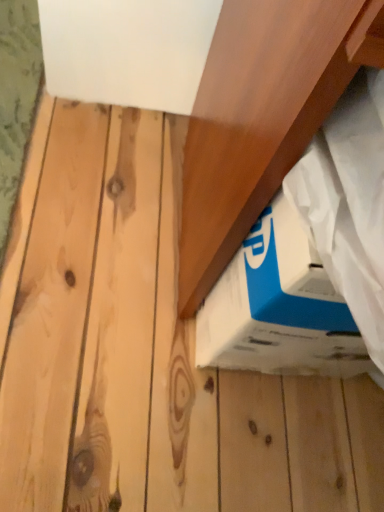
Question: In terms of width, does blue cardboard box at lower right look wider or thinner when compared to wooden at upper right?

Choices:
 (A) thin
 (B) wide

Answer: (A)

Question: From the image's perspective, is blue cardboard box at lower right located above or below wooden at upper right?

Choices:
 (A) below
 (B) above

Answer: (A)

Question: Do you think blue cardboard box at lower right is within wooden at upper right, or outside of it?

Choices:
 (A) inside
 (B) outside

Answer: (A)

Question: Is wooden at upper right in front of or behind blue cardboard box at lower right in the image?

Choices:
 (A) front
 (B) behind

Answer: (A)

Question: In terms of width, does wooden at upper right look wider or thinner when compared to blue cardboard box at lower right?

Choices:
 (A) wide
 (B) thin

Answer: (A)

Question: Is point (334, 35) positioned closer to the camera than point (251, 261)?

Choices:
 (A) farther
 (B) closer

Answer: (B)

Question: Visually, is wooden at upper right positioned to the left or to the right of blue cardboard box at lower right?

Choices:
 (A) left
 (B) right

Answer: (B)